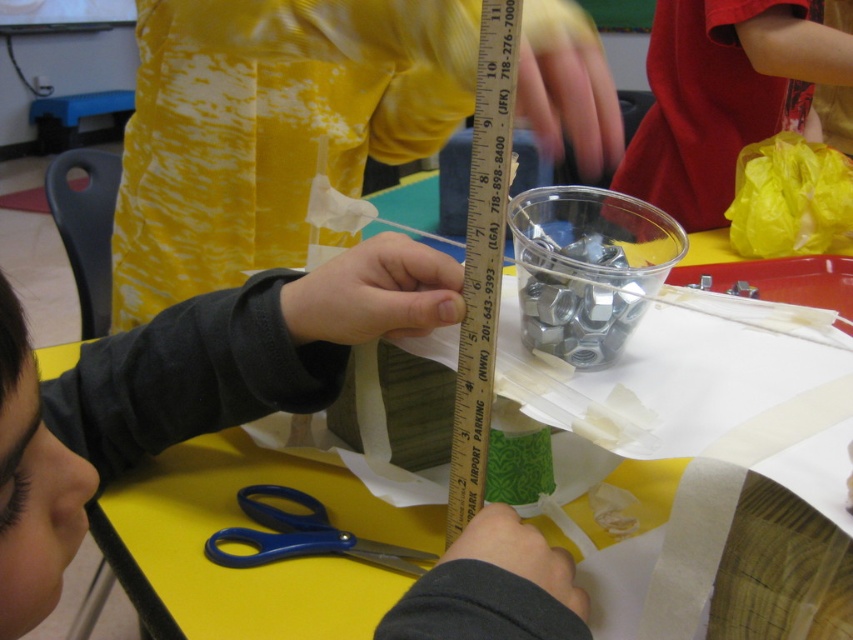
Question: Among these points, which one is farthest from the camera?

Choices:
 (A) (282, 481)
 (B) (496, 24)

Answer: (A)

Question: Is yellow paper at center above blue plastic scissors at lower center?

Choices:
 (A) yes
 (B) no

Answer: (A)

Question: Is wooden ruler at center to the right of blue plastic scissors at lower center from the viewer's perspective?

Choices:
 (A) yes
 (B) no

Answer: (A)

Question: Estimate the real-world distances between objects in this image. Which object is closer to the wooden ruler at center?

Choices:
 (A) yellow paper at center
 (B) blue plastic scissors at lower center

Answer: (A)

Question: Can you confirm if yellow paper at center is positioned to the right of blue plastic scissors at lower center?

Choices:
 (A) no
 (B) yes

Answer: (A)

Question: Which object is the closest to the blue plastic scissors at lower center?

Choices:
 (A) wooden ruler at center
 (B) yellow paper at center

Answer: (B)